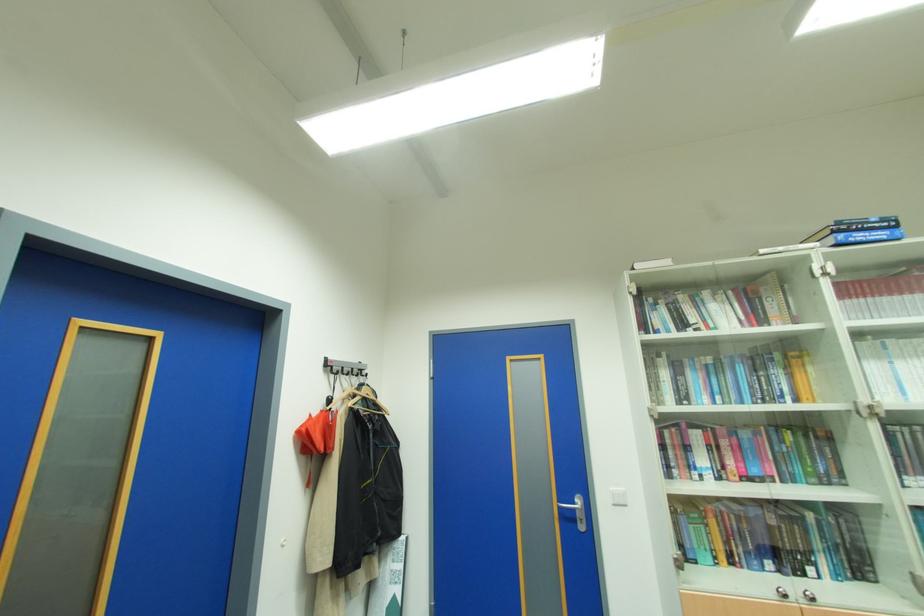
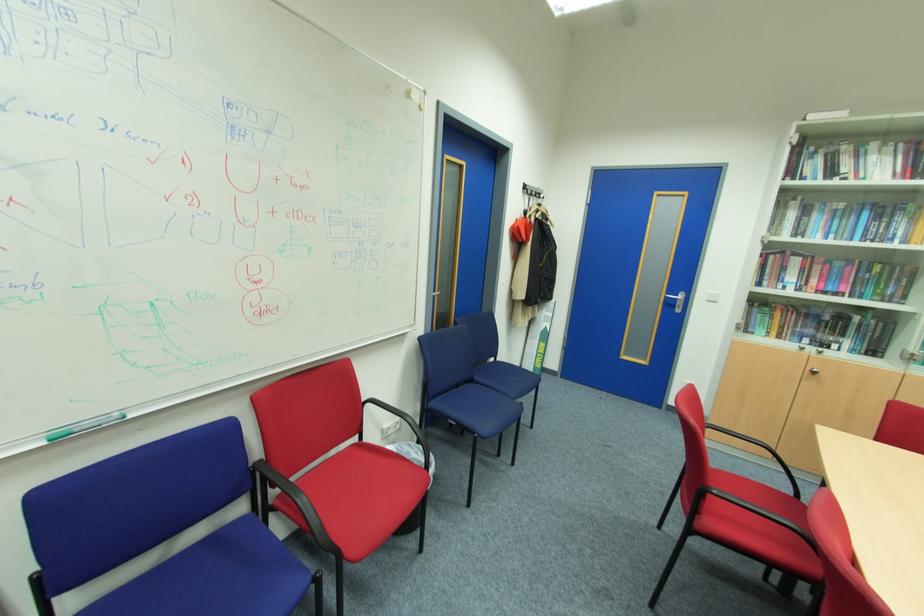
Where in the second image is the point corresponding to point 699,562 from the first image?

(756, 334)